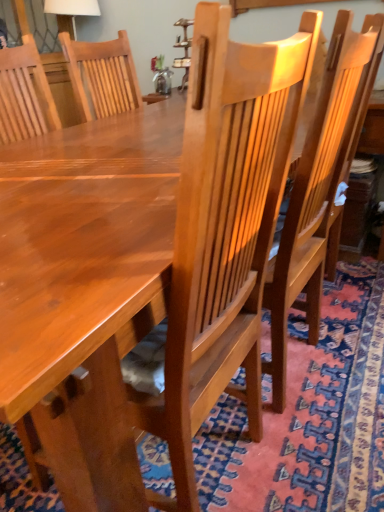
Question: Is carpeted floor at center taller than glossy wood chair at center?

Choices:
 (A) no
 (B) yes

Answer: (A)

Question: Is carpeted floor at center positioned beyond the bounds of glossy wood chair at center?

Choices:
 (A) no
 (B) yes

Answer: (B)

Question: Considering the relative positions of carpeted floor at center and glossy wood chair at center in the image provided, is carpeted floor at center to the right of glossy wood chair at center from the viewer's perspective?

Choices:
 (A) no
 (B) yes

Answer: (A)

Question: Is carpeted floor at center facing away from glossy wood chair at center?

Choices:
 (A) yes
 (B) no

Answer: (B)

Question: From a real-world perspective, is carpeted floor at center below glossy wood chair at center?

Choices:
 (A) no
 (B) yes

Answer: (B)

Question: Does carpeted floor at center have a lesser width compared to glossy wood chair at center?

Choices:
 (A) no
 (B) yes

Answer: (A)

Question: Is glossy wood chair at center further to camera compared to carpeted floor at center?

Choices:
 (A) no
 (B) yes

Answer: (B)

Question: Is carpeted floor at center surrounded by glossy wood chair at center?

Choices:
 (A) no
 (B) yes

Answer: (A)

Question: Can you confirm if glossy wood chair at center is thinner than carpeted floor at center?

Choices:
 (A) yes
 (B) no

Answer: (A)

Question: Is glossy wood chair at center in front of carpeted floor at center?

Choices:
 (A) yes
 (B) no

Answer: (B)

Question: From the image's perspective, does glossy wood chair at center appear lower than carpeted floor at center?

Choices:
 (A) no
 (B) yes

Answer: (A)

Question: Is the surface of glossy wood chair at center in direct contact with carpeted floor at center?

Choices:
 (A) yes
 (B) no

Answer: (B)

Question: In terms of width, does carpeted floor at center look wider or thinner when compared to glossy wood chair at center?

Choices:
 (A) thin
 (B) wide

Answer: (B)